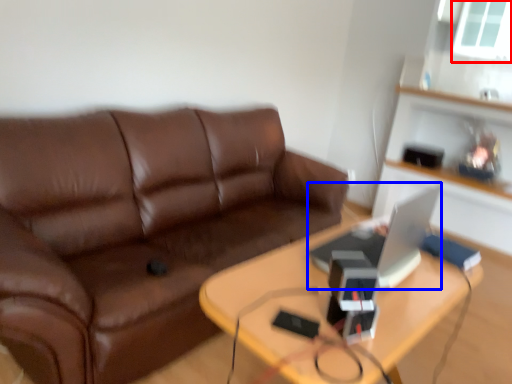
Question: Which point is closer to the camera, window screen (highlighted by a red box) or computer (highlighted by a blue box)?

Choices:
 (A) window screen
 (B) computer

Answer: (B)